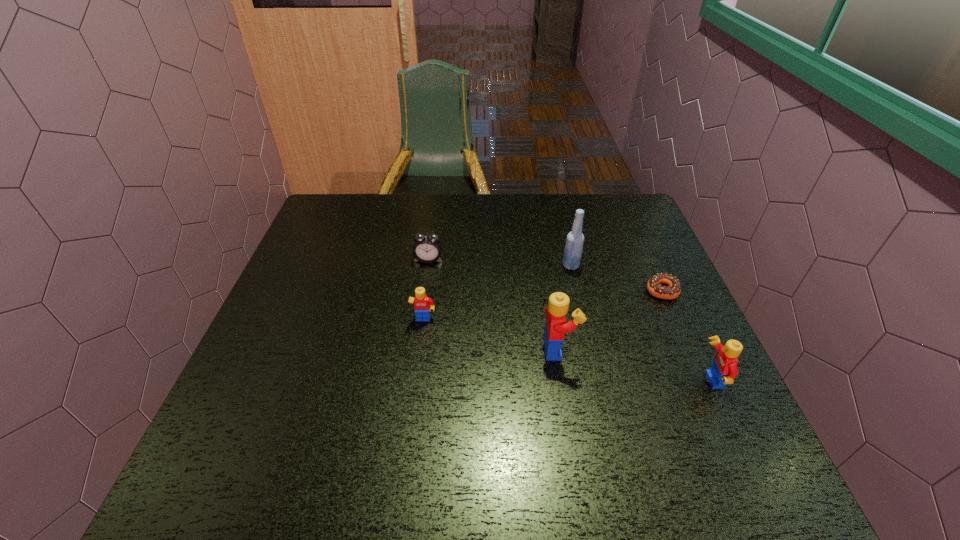
Where is `free space between the alarm clock and the bottle`? This screenshot has width=960, height=540. free space between the alarm clock and the bottle is located at coordinates coord(499,262).

Where is `vacant region between the fourth object from left to right and the shortest Lego`? The image size is (960, 540). vacant region between the fourth object from left to right and the shortest Lego is located at coordinates (497, 293).

What are the coordinates of `unoccupied area between the alarm clock and the second Lego from right to left` in the screenshot? It's located at (493, 304).

Find the location of a particular element. The image size is (960, 540). vacant space that is in between the leftmost Lego and the alarm clock is located at coordinates tap(426, 290).

The width and height of the screenshot is (960, 540). In order to click on free space between the shortest Lego and the third object from right to left in this screenshot , I will do (497, 293).

Locate an element on the screen. The image size is (960, 540). vacant region between the tallest Lego and the shortest object is located at coordinates (610, 320).

This screenshot has height=540, width=960. In order to click on free point between the fourth nearest object and the bottle in this screenshot , I will do `click(616, 278)`.

Select which object is the second closest to the bottle. Please provide its 2D coordinates. Your answer should be formatted as a tuple, i.e. [(x, y)], where the tuple contains the x and y coordinates of a point satisfying the conditions above.

[(556, 327)]

I want to click on the fifth closest object to the shortest Lego, so click(x=724, y=369).

Identify which Lego is the second closest to the alarm clock. Please provide its 2D coordinates. Your answer should be formatted as a tuple, i.e. [(x, y)], where the tuple contains the x and y coordinates of a point satisfying the conditions above.

[(556, 327)]